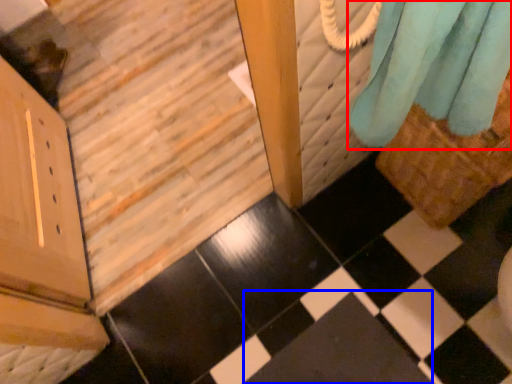
Question: Which of the following is the closest to the observer, curtain (highlighted by a red box) or square (highlighted by a blue box)?

Choices:
 (A) curtain
 (B) square

Answer: (A)